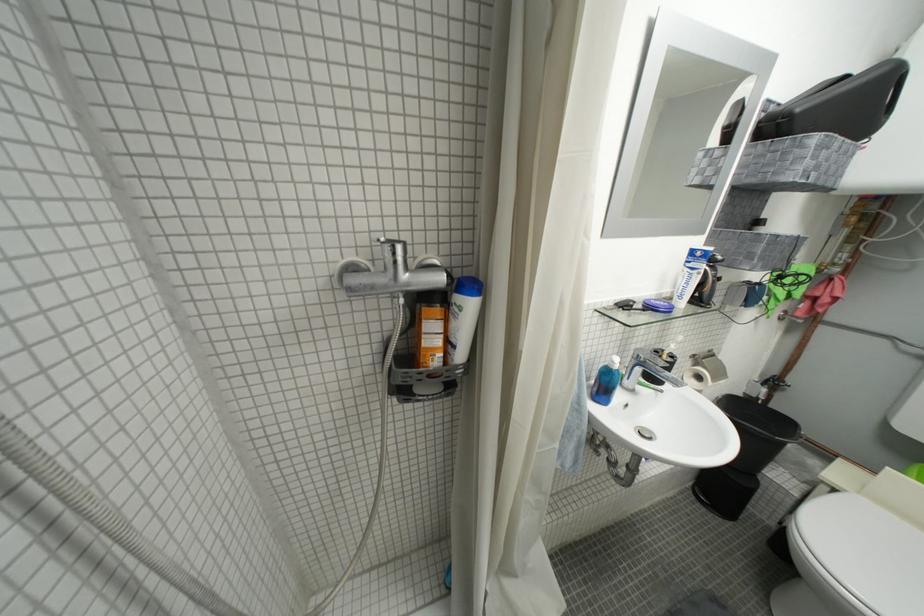
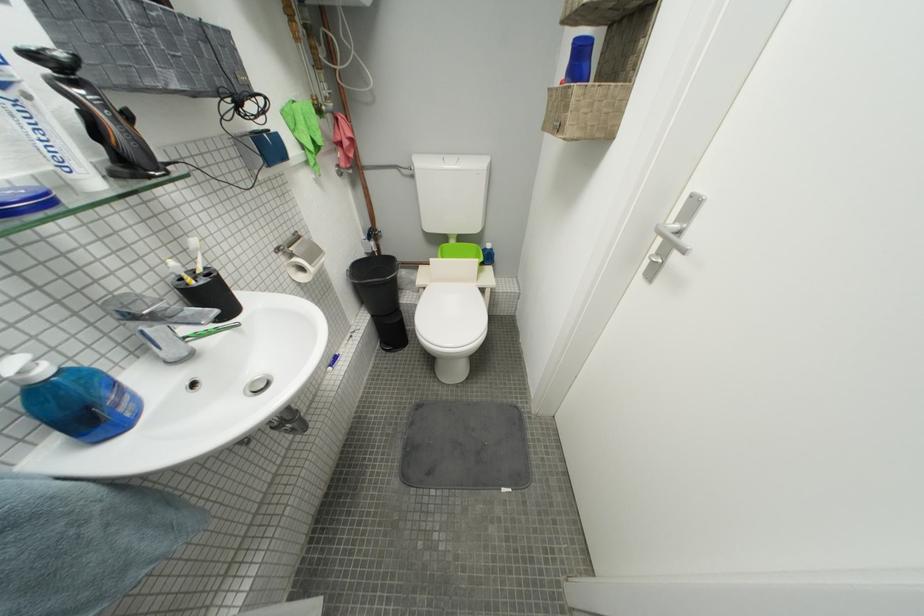
In the second image, find the point that corresponds to [690,306] in the first image.

(103, 185)